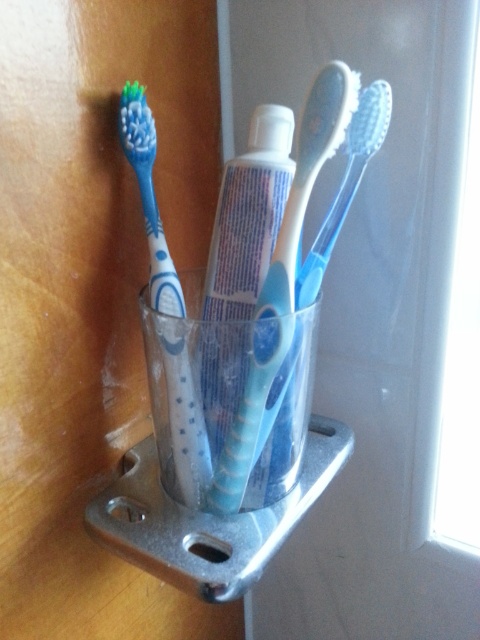
Question: Among these points, which one is farthest from the camera?

Choices:
 (A) (299, 145)
 (B) (243, 252)

Answer: (B)

Question: Estimate the real-world distances between objects in this image. Which object is closer to the blue rubber toothbrush at left?

Choices:
 (A) blue glossy toothpaste at center
 (B) blue rubber toothbrush at center
 (C) translucent plastic toothbrush at center

Answer: (A)

Question: Is blue glossy toothpaste at center thinner than translucent plastic toothbrush at center?

Choices:
 (A) yes
 (B) no

Answer: (A)

Question: Which point is farther to the camera?

Choices:
 (A) (287, 378)
 (B) (199, 497)
 (C) (216, 307)
 (D) (336, 198)

Answer: (D)

Question: Does blue rubber toothbrush at left appear over translucent plastic toothbrush at center?

Choices:
 (A) yes
 (B) no

Answer: (B)

Question: Does blue glossy toothpaste at center have a lesser width compared to translucent plastic toothbrush at center?

Choices:
 (A) no
 (B) yes

Answer: (B)